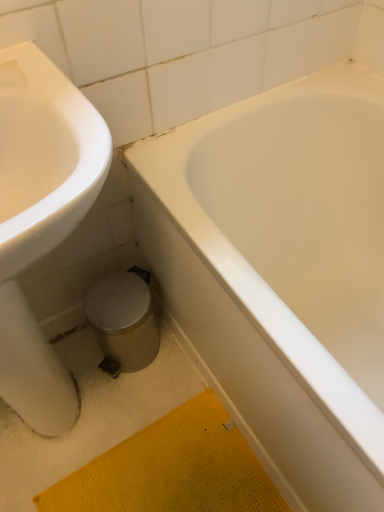
Question: Looking at their shapes, would you say white glossy bathtub at center is wider or thinner than yellow textured bath mat at lower center?

Choices:
 (A) thin
 (B) wide

Answer: (B)

Question: Relative to yellow textured bath mat at lower center, is white glossy bathtub at center in front or behind?

Choices:
 (A) behind
 (B) front

Answer: (B)

Question: Based on their relative distances, which object is nearer to the white glossy bathtub at center?

Choices:
 (A) white glossy sink at left
 (B) yellow textured bath mat at lower center

Answer: (B)

Question: Estimate the real-world distances between objects in this image. Which object is closer to the white glossy bathtub at center?

Choices:
 (A) yellow textured bath mat at lower center
 (B) white glossy sink at left

Answer: (A)